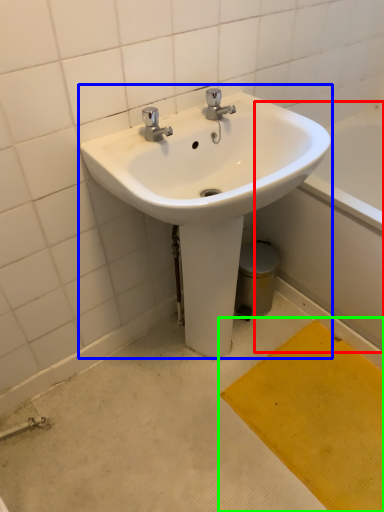
Question: Based on their relative distances, which object is nearer to bath (highlighted by a red box)? Choose from sink (highlighted by a blue box) and doormat (highlighted by a green box).

Choices:
 (A) sink
 (B) doormat

Answer: (B)